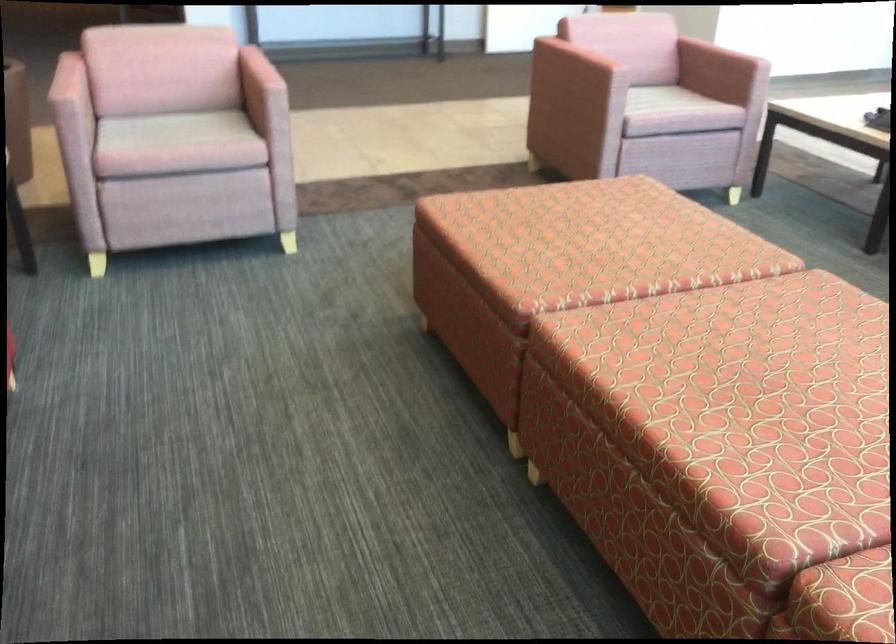
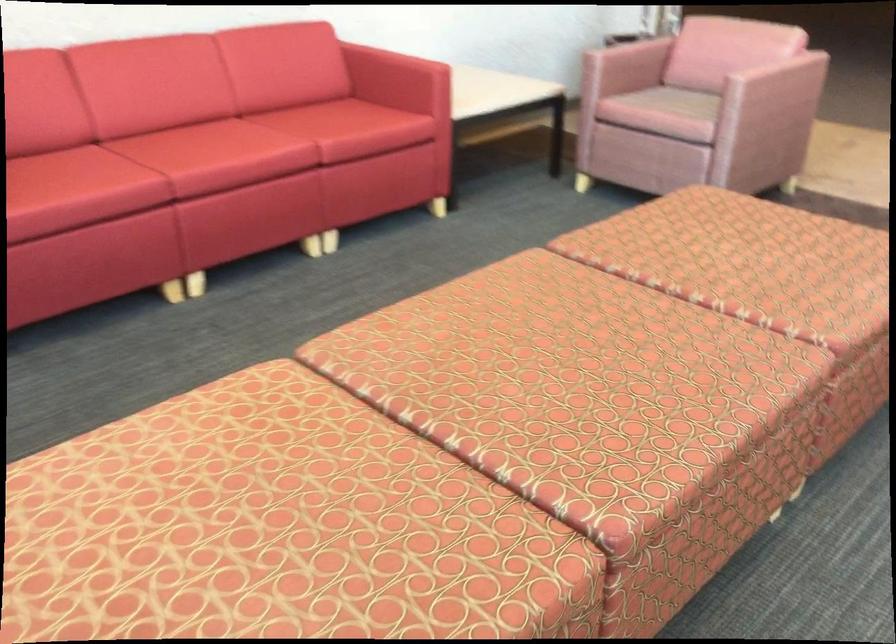
Locate, in the second image, the point that corresponds to (174,129) in the first image.

(686, 102)